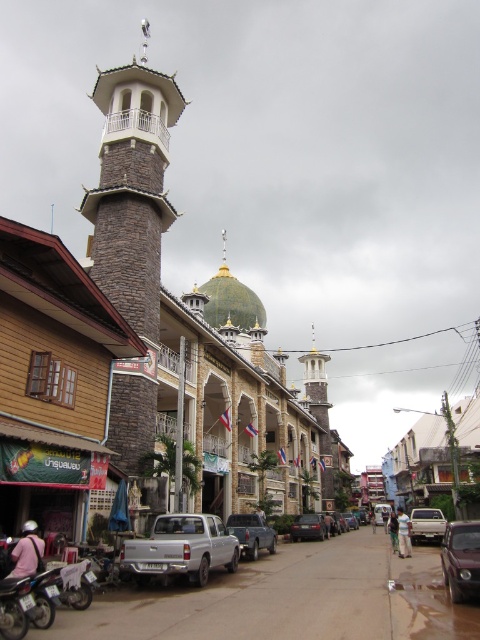
Is point (15, 566) positioned behind point (325, 536)?

No, it is not.

Between light pink fabric helmet at lower left and shiny black sedan at center, which one is positioned higher?

light pink fabric helmet at lower left

At what (x,y) coordinates should I click in order to perform the action: click on light pink fabric helmet at lower left. Please return your answer as a coordinate pair (x, y). This screenshot has height=640, width=480. Looking at the image, I should click on (26, 552).

What are the coordinates of `light pink fabric helmet at lower left` in the screenshot? It's located at (26, 552).

Is shiny dark brown car at lower right above white fabric shirt at center?

Correct, shiny dark brown car at lower right is located above white fabric shirt at center.

What do you see at coordinates (460, 560) in the screenshot?
I see `shiny dark brown car at lower right` at bounding box center [460, 560].

You are a GUI agent. You are given a task and a screenshot of the screen. Output one action in this format:
    pyautogui.click(x=<x>, y=<y>)
    Task: Click on the shiny dark brown car at lower right
    This screenshot has width=480, height=640.
    Given the screenshot: What is the action you would take?
    pyautogui.click(x=460, y=560)

Can you confirm if silver metallic pickup truck at center is wider than shiny dark brown car at lower right?

Yes.

Does point (180, 516) come farther from viewer compared to point (468, 557)?

Yes.

Image resolution: width=480 pixels, height=640 pixels. Describe the element at coordinates (180, 548) in the screenshot. I see `silver metallic pickup truck at center` at that location.

Identify the location of silver metallic pickup truck at center. This screenshot has width=480, height=640. (180, 548).